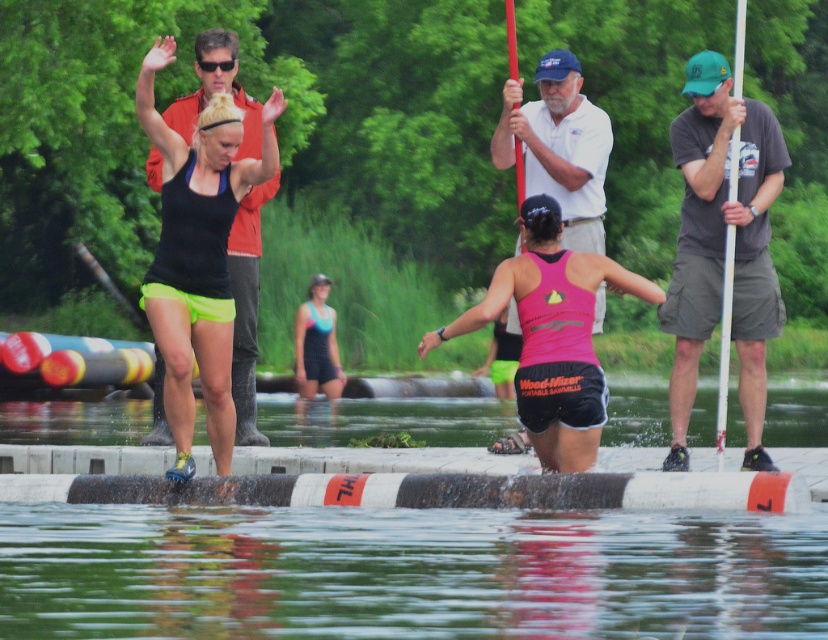
You are a photographer trying to capture the scene from the platform. You notice the transparent water at lower center and the orange fabric jacket at upper left. Which object is closer to the camera based on their sizes?

The transparent water at lower center is shorter than the orange fabric jacket at upper left, so the orange fabric jacket at upper left is closer to the camera because objects closer to the camera appear larger.

You are a photographer standing on the platform at the water sports event. You see the transparent water at lower center and the white cotton shirt at center. Which object is located to the right of the other?

The transparent water at lower center is positioned on the right side of white cotton shirt at center.

You are a photographer trying to capture the entire scene of the water sports event. You notice the transparent water at lower center and the orange fabric jacket at upper left. Which object takes up more horizontal space in the image?

The orange fabric jacket at upper left takes up more horizontal space because the transparent water at lower center is narrower than the orange fabric jacket at upper left.